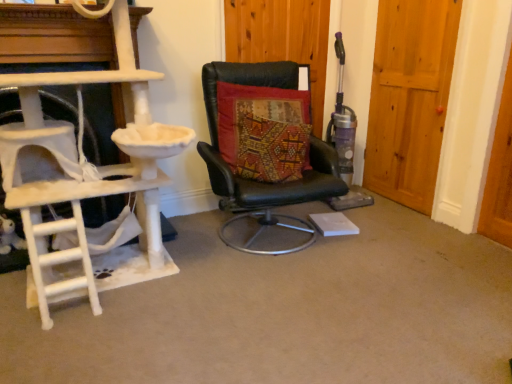
Question: Is textured multicolored cushion at center completely or partially outside of white carpeted ladder at left?

Choices:
 (A) yes
 (B) no

Answer: (A)

Question: Is the position of textured multicolored cushion at center less distant than that of white carpeted ladder at left?

Choices:
 (A) yes
 (B) no

Answer: (B)

Question: Considering the relative sizes of textured multicolored cushion at center and white carpeted ladder at left in the image provided, is textured multicolored cushion at center taller than white carpeted ladder at left?

Choices:
 (A) yes
 (B) no

Answer: (B)

Question: Is textured multicolored cushion at center looking in the opposite direction of white carpeted ladder at left?

Choices:
 (A) no
 (B) yes

Answer: (A)

Question: Considering the relative positions of textured multicolored cushion at center and white carpeted ladder at left in the image provided, is textured multicolored cushion at center to the right of white carpeted ladder at left from the viewer's perspective?

Choices:
 (A) no
 (B) yes

Answer: (B)

Question: Could you tell me if textured multicolored cushion at center is facing white carpeted ladder at left?

Choices:
 (A) no
 (B) yes

Answer: (A)

Question: Could you tell me if wooden door at center, the 2th door positioned from the right, is turned towards textured multicolored cushion at center?

Choices:
 (A) yes
 (B) no

Answer: (A)

Question: From a real-world perspective, is wooden door at center, the 2th door positioned from the right, physically below textured multicolored cushion at center?

Choices:
 (A) yes
 (B) no

Answer: (B)

Question: From the image's perspective, is wooden door at center, the 2th door positioned from the right, located above textured multicolored cushion at center?

Choices:
 (A) no
 (B) yes

Answer: (B)

Question: Considering the relative sizes of wooden door at center, the 1th door positioned from the left, and textured multicolored cushion at center in the image provided, is wooden door at center, the 1th door positioned from the left, taller than textured multicolored cushion at center?

Choices:
 (A) yes
 (B) no

Answer: (A)

Question: Is wooden door at center, the 1th door positioned from the left, at the left side of textured multicolored cushion at center?

Choices:
 (A) yes
 (B) no

Answer: (B)

Question: Is wooden door at center, the 1th door positioned from the left, next to textured multicolored cushion at center?

Choices:
 (A) no
 (B) yes

Answer: (A)

Question: From the image's perspective, is textured multicolored cushion at center located beneath black leather chair at center?

Choices:
 (A) no
 (B) yes

Answer: (A)